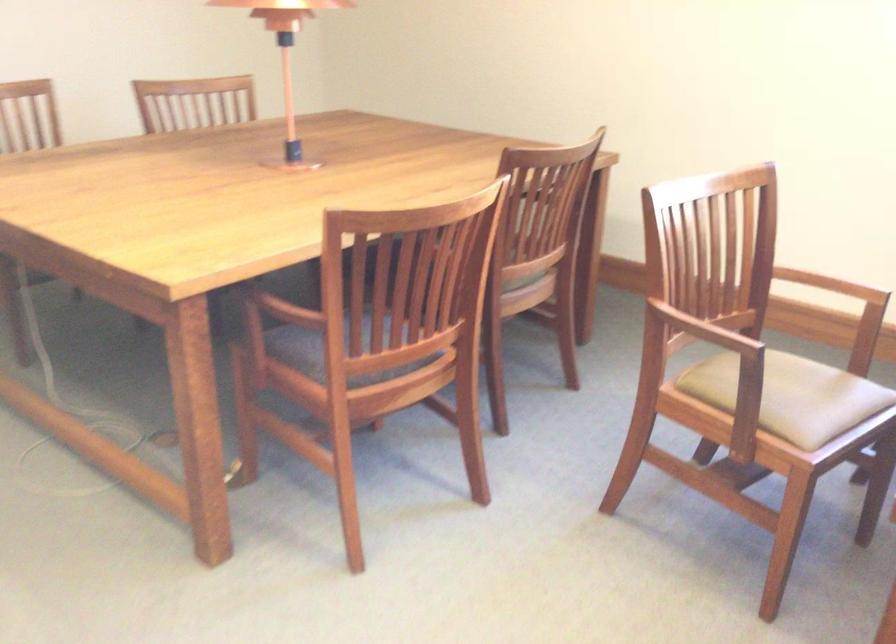
Where would you sit the beige chair sitting surface? Please return your answer as a coordinate pair (x, y).

(819, 408)